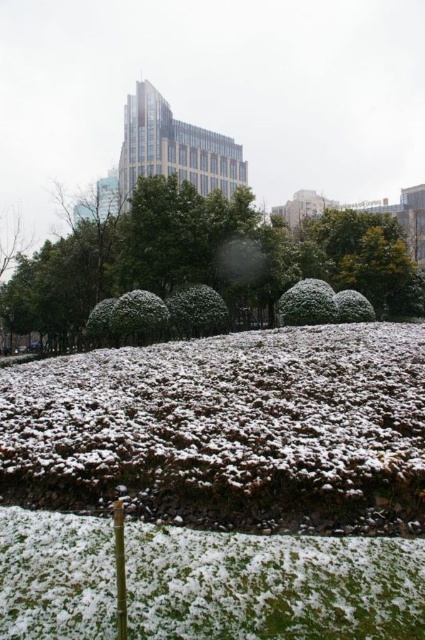
You are a landscape architect designing a walking path through the park. The path must start at the green grassy patch at lower center and end at the green textured bush at center. What is the minimum length the path should be to ensure it reaches the bush?

The minimum length of the path should be at least 19.06 meters to ensure it reaches the green textured bush at center from the green grassy patch at lower center.